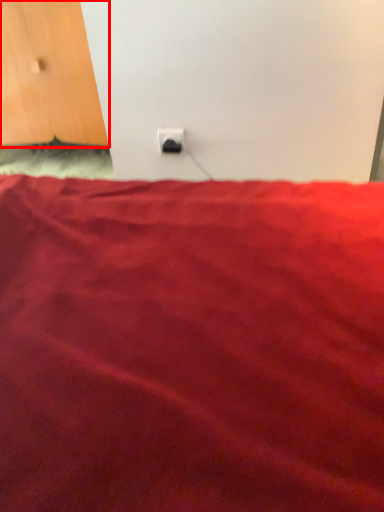
Question: From the image's perspective, considering the relative positions of door (annotated by the red box) and power plugs and sockets in the image provided, where is door (annotated by the red box) located with respect to the staircase?

Choices:
 (A) above
 (B) below

Answer: (A)